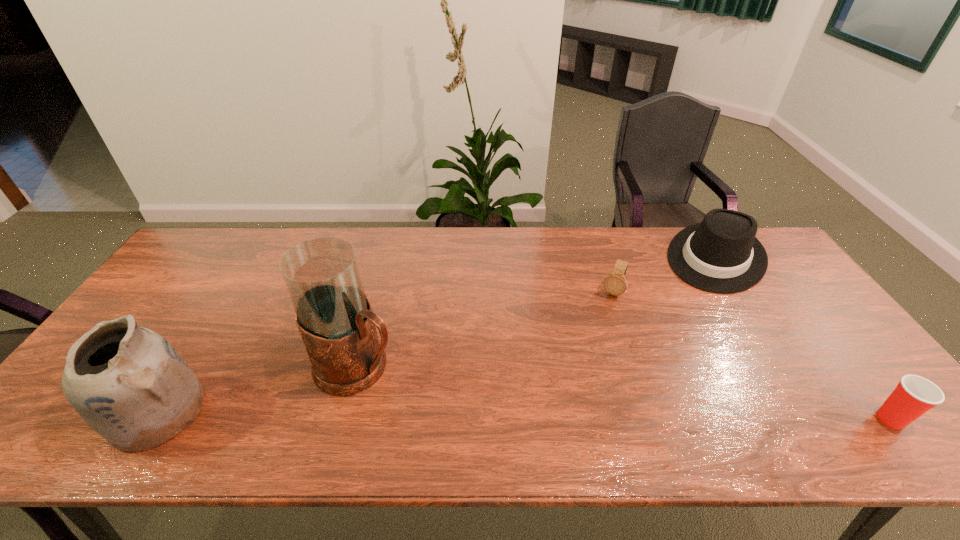
Identify the location of Dixie cup that is at the near edge. The image size is (960, 540). (914, 395).

At what (x,y) coordinates should I click in order to perform the action: click on pitcher located at the near edge. Please return your answer as a coordinate pair (x, y). This screenshot has width=960, height=540. Looking at the image, I should click on (334, 316).

Find the location of `object that is positioned at the left edge`. object that is positioned at the left edge is located at coordinates (129, 384).

At what (x,y) coordinates should I click in order to perform the action: click on Dixie cup present at the right edge. Please return your answer as a coordinate pair (x, y). The height and width of the screenshot is (540, 960). Looking at the image, I should click on (914, 395).

You are a GUI agent. You are given a task and a screenshot of the screen. Output one action in this format:
    pyautogui.click(x=<x>, y=<y>)
    Task: Click on the fedora positioned at the right edge
    This screenshot has width=960, height=540.
    Given the screenshot: What is the action you would take?
    pyautogui.click(x=722, y=255)

The height and width of the screenshot is (540, 960). What are the coordinates of `object that is at the near left corner` in the screenshot? It's located at (129, 384).

Find the location of a particular element. object located at the far right corner is located at coordinates click(722, 255).

The height and width of the screenshot is (540, 960). In order to click on object at the near right corner in this screenshot , I will do `click(914, 395)`.

This screenshot has width=960, height=540. Find the location of `vacant area at the far edge`. vacant area at the far edge is located at coordinates (483, 259).

Locate an element on the screen. This screenshot has height=540, width=960. vacant space at the near edge of the desktop is located at coordinates (546, 402).